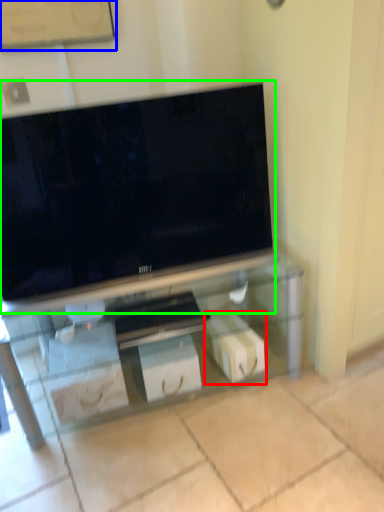
Question: Which object is positioned closest to box (highlighted by a red box)? Select from bulletin board (highlighted by a blue box) and television (highlighted by a green box).

Choices:
 (A) bulletin board
 (B) television

Answer: (B)